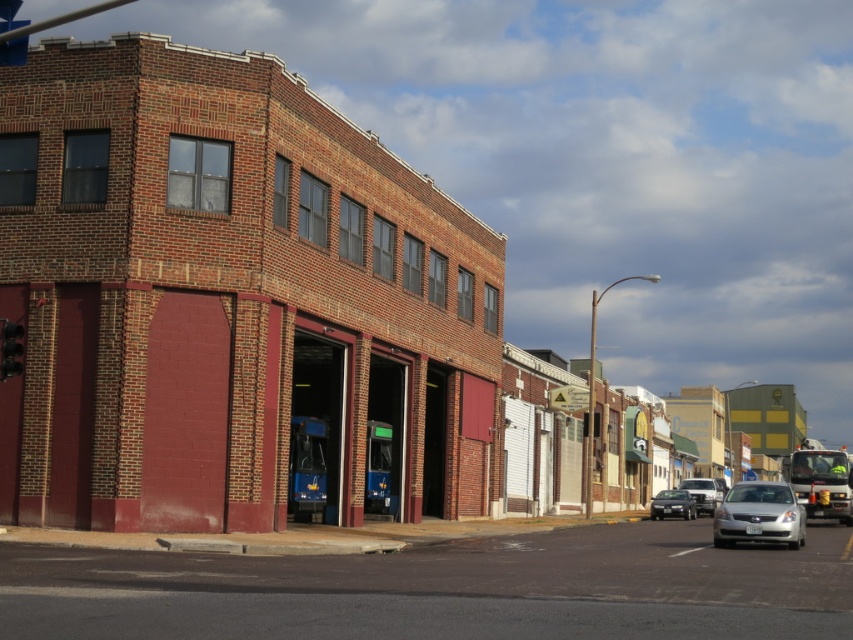
Can you confirm if silver metallic sedan at center-right is bigger than silver metallic sedan at center?

Indeed, silver metallic sedan at center-right has a larger size compared to silver metallic sedan at center.

Is point (741, 502) farther from viewer compared to point (695, 499)?

No, (741, 502) is closer to viewer.

Does point (740, 504) come in front of point (695, 486)?

Yes, point (740, 504) is in front of point (695, 486).

Find the location of a particular element. silver metallic sedan at center-right is located at coordinates (758, 515).

Can you confirm if satin silver sedan at center is positioned below silver metallic sedan at center?

Yes, satin silver sedan at center is below silver metallic sedan at center.

Between satin silver sedan at center and silver metallic sedan at center, which one appears on the right side from the viewer's perspective?

From the viewer's perspective, silver metallic sedan at center appears more on the right side.

Between point (680, 500) and point (698, 497), which one is positioned in front?

Positioned in front is point (680, 500).

Where is `satin silver sedan at center`? The image size is (853, 640). satin silver sedan at center is located at coordinates (672, 504).

Is metallic at left wider than silver metallic sedan at center?

No, metallic at left is not wider than silver metallic sedan at center.

Is metallic at left to the right of silver metallic sedan at center from the viewer's perspective?

In fact, metallic at left is to the left of silver metallic sedan at center.

Is point (10, 333) positioned after point (711, 500)?

No, (10, 333) is in front of (711, 500).

Image resolution: width=853 pixels, height=640 pixels. What are the coordinates of `metallic at left` in the screenshot? It's located at (10, 348).